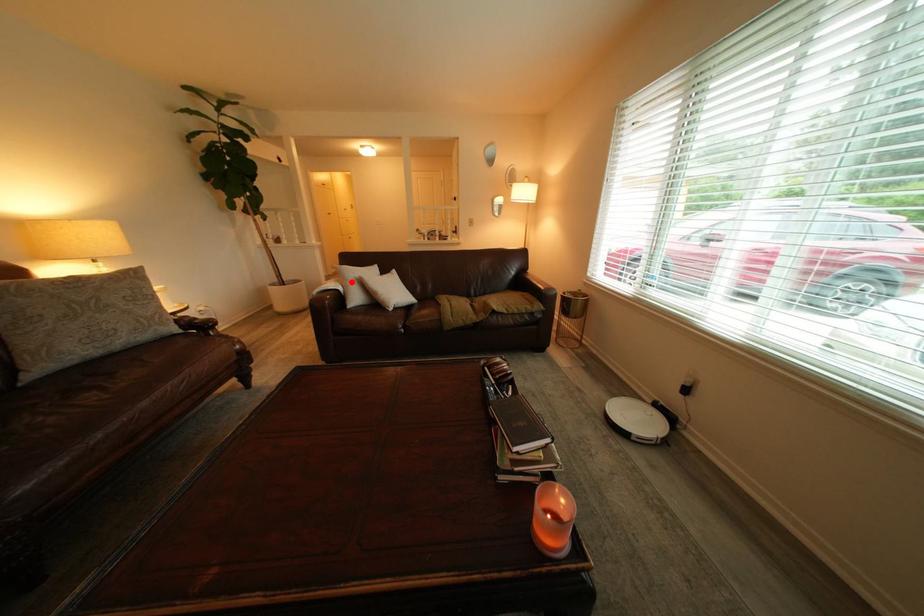
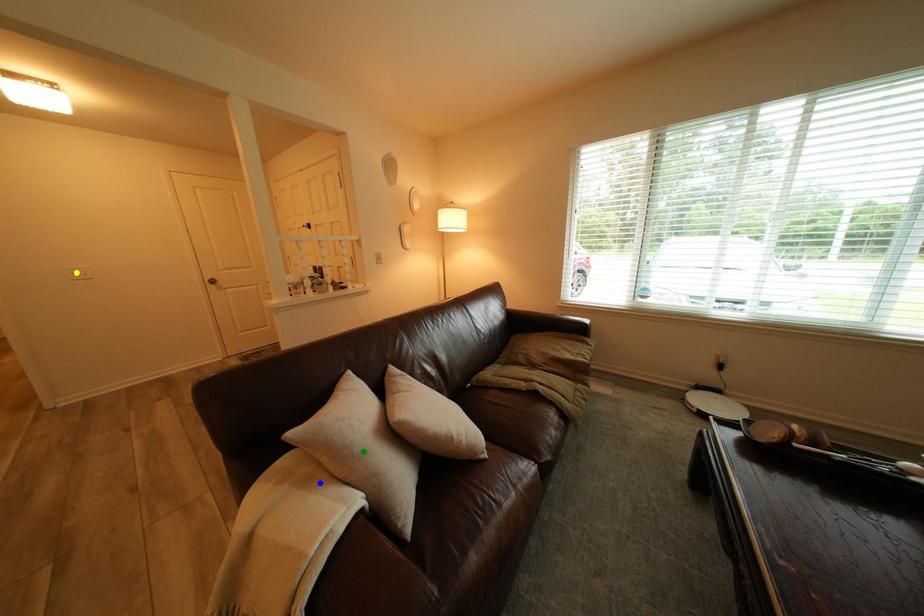
Question: I am providing you with two images of the same scene from different viewpoints. A red point is marked on the first image. You are given multiple points on the second image. Which point in image 2 is actually the same real-world point as the red point in image 1?

Choices:
 (A) green point
 (B) blue point
 (C) yellow point

Answer: (B)